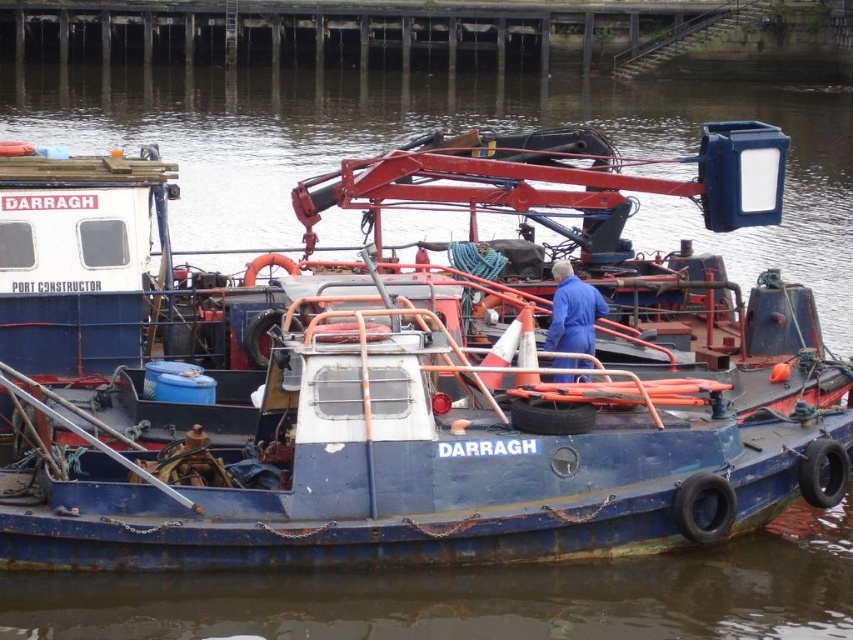
Question: Is blue matte boat at center to the right of blue smooth coveralls at center from the viewer's perspective?

Choices:
 (A) no
 (B) yes

Answer: (A)

Question: Which of the following is the closest to the observer?

Choices:
 (A) coord(770,353)
 (B) coord(572,316)

Answer: (B)

Question: Does blue matte boat at center have a larger size compared to blue smooth coveralls at center?

Choices:
 (A) yes
 (B) no

Answer: (A)

Question: Can you confirm if blue matte boat at center is positioned to the left of blue smooth coveralls at center?

Choices:
 (A) yes
 (B) no

Answer: (A)